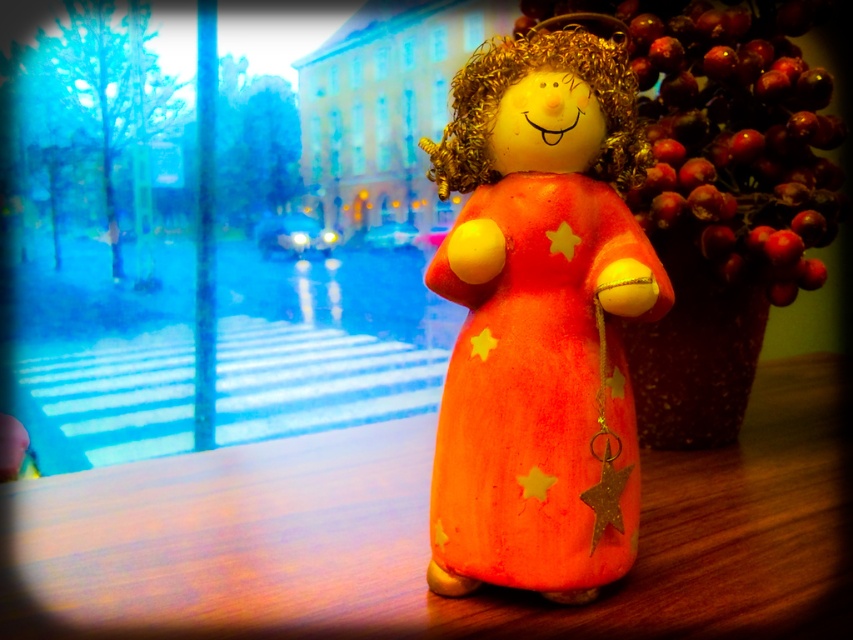
Who is higher up, orange felt table at center or orange felt dress at center?

orange felt dress at center

Which is below, orange felt table at center or orange felt dress at center?

Positioned lower is orange felt table at center.

Locate an element on the screen. The image size is (853, 640). orange felt table at center is located at coordinates (426, 538).

Is point (102, 552) closer to viewer compared to point (666, 113)?

Yes, point (102, 552) is closer to viewer.

Measure the distance between orange felt table at center and camera.

orange felt table at center is 74.00 centimeters away from camera.

You are a GUI agent. You are given a task and a screenshot of the screen. Output one action in this format:
    pyautogui.click(x=<x>, y=<y>)
    Task: Click on the orange felt table at center
    The width and height of the screenshot is (853, 640).
    Given the screenshot: What is the action you would take?
    pyautogui.click(x=426, y=538)

Is point (561, 595) positioned before point (532, 12)?

Yes, point (561, 595) is closer to viewer.

Which is behind, point (612, 420) or point (701, 10)?

The point (701, 10) is more distant.

You are a GUI agent. You are given a task and a screenshot of the screen. Output one action in this format:
    pyautogui.click(x=<x>, y=<y>)
    Task: Click on the orange felt dress at center
    The height and width of the screenshot is (640, 853).
    Given the screenshot: What is the action you would take?
    pyautogui.click(x=538, y=388)